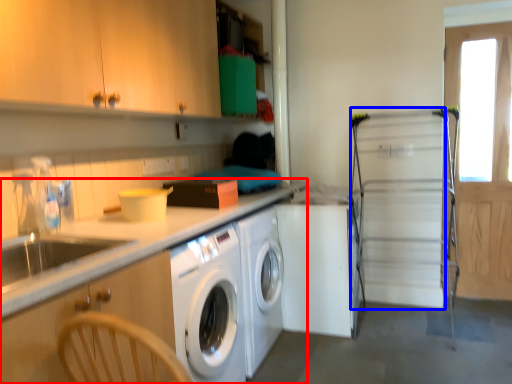
Question: Which object appears farthest to the camera in this image, countertop (highlighted by a red box) or screen door (highlighted by a blue box)?

Choices:
 (A) countertop
 (B) screen door

Answer: (B)